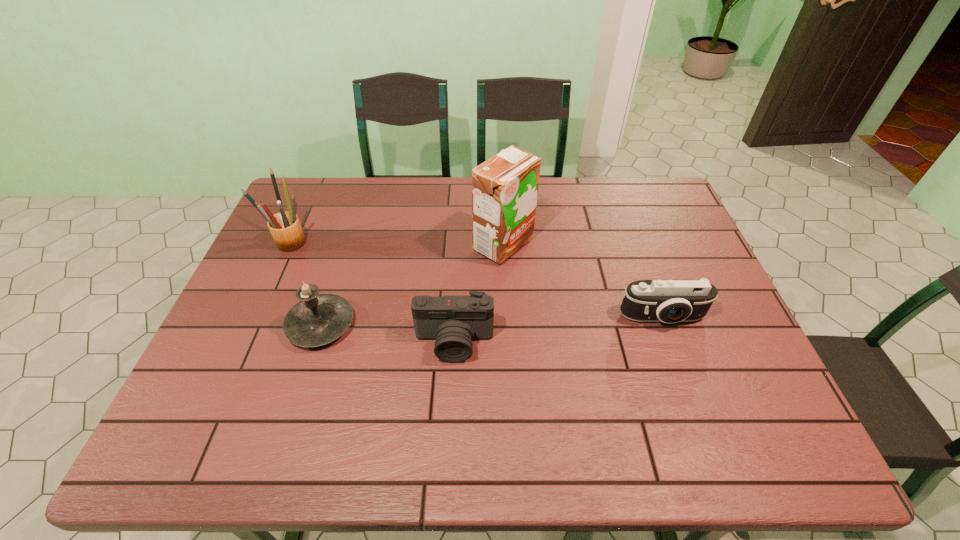
The width and height of the screenshot is (960, 540). What are the coordinates of `carton` in the screenshot? It's located at (505, 187).

Identify the location of the leftmost object. Image resolution: width=960 pixels, height=540 pixels. (285, 227).

At what (x,y) coordinates should I click in order to perform the action: click on pencil box. Please return your answer as a coordinate pair (x, y). The image size is (960, 540). Looking at the image, I should click on pyautogui.click(x=285, y=227).

I want to click on candle, so click(318, 319).

Image resolution: width=960 pixels, height=540 pixels. I want to click on the third tallest object, so click(x=318, y=319).

Where is `the rightmost object`? the rightmost object is located at coordinates (670, 301).

This screenshot has height=540, width=960. Find the location of `the left camera`. the left camera is located at coordinates (453, 321).

Image resolution: width=960 pixels, height=540 pixels. I want to click on free space located on the straw side of the tallest object, so click(396, 244).

Identify the location of vacant region located on the straw side of the tallest object. The height and width of the screenshot is (540, 960). (410, 244).

Locate an element on the screen. Image resolution: width=960 pixels, height=540 pixels. free space located 0.300m on the straw side of the tallest object is located at coordinates (373, 244).